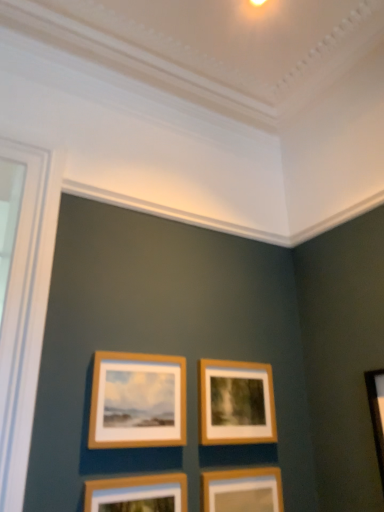
Where is `wooden frame at center, which is the third picture frame from bottom to top`? wooden frame at center, which is the third picture frame from bottom to top is located at coordinates (236, 403).

Find the location of a particular element. wooden picture frame at lower center, which ranks as the 2th picture frame in bottom-to-top order is located at coordinates 138,494.

Where is `wooden frame at center, which is the third picture frame from bottom to top`? This screenshot has width=384, height=512. wooden frame at center, which is the third picture frame from bottom to top is located at coordinates click(x=236, y=403).

Who is taller, wooden picture frame at lower center, which ranks as the 2th picture frame in bottom-to-top order, or wooden picture frame at lower center, which is the 4th picture frame from top to bottom?

wooden picture frame at lower center, which ranks as the 2th picture frame in bottom-to-top order.

Can you confirm if wooden picture frame at lower center, which ranks as the 2th picture frame in bottom-to-top order, is smaller than wooden picture frame at lower center, which is counted as the 1th picture frame, starting from the bottom?

Incorrect, wooden picture frame at lower center, which ranks as the 2th picture frame in bottom-to-top order, is not smaller in size than wooden picture frame at lower center, which is counted as the 1th picture frame, starting from the bottom.

Between wooden picture frame at lower center, which is counted as the 1th picture frame, starting from the bottom, and wooden picture frame at lower center, the third picture frame when ordered from top to bottom, which one appears on the right side from the viewer's perspective?

wooden picture frame at lower center, which is counted as the 1th picture frame, starting from the bottom.

Is wooden picture frame at lower center, which is counted as the 1th picture frame, starting from the bottom, spatially inside wooden picture frame at lower center, the third picture frame when ordered from top to bottom, or outside of it?

wooden picture frame at lower center, which is counted as the 1th picture frame, starting from the bottom, is outside wooden picture frame at lower center, the third picture frame when ordered from top to bottom.

Which of these two, wooden picture frame at lower center, which is counted as the 1th picture frame, starting from the bottom, or wooden picture frame at lower center, the third picture frame when ordered from top to bottom, stands shorter?

wooden picture frame at lower center, which is counted as the 1th picture frame, starting from the bottom, is shorter.

Is point (266, 472) closer to viewer compared to point (91, 508)?

No, (266, 472) is further to viewer.

Is wooden frame at center, the second picture frame from the top, behind wooden frame at center, placed as the fourth picture frame when sorted from bottom to top?

Yes, it is behind wooden frame at center, placed as the fourth picture frame when sorted from bottom to top.

From the image's perspective, is wooden frame at center, which is the third picture frame from bottom to top, above or below wooden frame at center, which ranks as the first picture frame in top-to-bottom order?

Clearly, from the image's perspective, wooden frame at center, which is the third picture frame from bottom to top, is below wooden frame at center, which ranks as the first picture frame in top-to-bottom order.

Is wooden frame at center, the second picture frame from the top, looking in the opposite direction of wooden frame at center, which ranks as the first picture frame in top-to-bottom order?

No, wooden frame at center, the second picture frame from the top,'s orientation is not away from wooden frame at center, which ranks as the first picture frame in top-to-bottom order.

Between wooden frame at center, which is the third picture frame from bottom to top, and wooden frame at center, which ranks as the first picture frame in top-to-bottom order, which one has smaller size?

wooden frame at center, which is the third picture frame from bottom to top.

From a real-world perspective, which is physically above, wooden frame at center, which is the third picture frame from bottom to top, or wooden picture frame at lower center, which is the 4th picture frame from top to bottom?

In real-world perspective, wooden frame at center, which is the third picture frame from bottom to top, is above.

Is wooden frame at center, the second picture frame from the top, not close to wooden picture frame at lower center, which is counted as the 1th picture frame, starting from the bottom?

No, wooden frame at center, the second picture frame from the top, is not far from wooden picture frame at lower center, which is counted as the 1th picture frame, starting from the bottom.

Is wooden picture frame at lower center, which is counted as the 1th picture frame, starting from the bottom, inside wooden frame at center, the second picture frame from the top?

No, wooden frame at center, the second picture frame from the top, does not contain wooden picture frame at lower center, which is counted as the 1th picture frame, starting from the bottom.

Considering the relative positions of wooden frame at center, placed as the fourth picture frame when sorted from bottom to top, and wooden picture frame at lower center, which is the 4th picture frame from top to bottom, in the image provided, is wooden frame at center, placed as the fourth picture frame when sorted from bottom to top, to the left of wooden picture frame at lower center, which is the 4th picture frame from top to bottom, from the viewer's perspective?

Correct, you'll find wooden frame at center, placed as the fourth picture frame when sorted from bottom to top, to the left of wooden picture frame at lower center, which is the 4th picture frame from top to bottom.

In the image, is wooden frame at center, placed as the fourth picture frame when sorted from bottom to top, positioned in front of or behind wooden picture frame at lower center, which is counted as the 1th picture frame, starting from the bottom?

wooden frame at center, placed as the fourth picture frame when sorted from bottom to top, is in front of wooden picture frame at lower center, which is counted as the 1th picture frame, starting from the bottom.

From the image's perspective, starting from the wooden frame at center, which ranks as the first picture frame in top-to-bottom order, which picture frame is the 3rd one below? Please provide its 2D coordinates.

[(242, 490)]

From the image's perspective, is wooden frame at center, placed as the fourth picture frame when sorted from bottom to top, located above or below wooden frame at center, which is the third picture frame from bottom to top?

Based on their image positions, wooden frame at center, placed as the fourth picture frame when sorted from bottom to top, is located above wooden frame at center, which is the third picture frame from bottom to top.

Which of these two, wooden frame at center, which ranks as the first picture frame in top-to-bottom order, or wooden frame at center, the second picture frame from the top, stands taller?

wooden frame at center, which ranks as the first picture frame in top-to-bottom order.

Is point (169, 443) positioned before point (231, 390)?

Yes.

Is wooden frame at center, the second picture frame from the top, completely or partially inside wooden frame at center, placed as the fourth picture frame when sorted from bottom to top?

No.

From the image's perspective, is wooden picture frame at lower center, which ranks as the 2th picture frame in bottom-to-top order, above or below wooden frame at center, placed as the fourth picture frame when sorted from bottom to top?

wooden picture frame at lower center, which ranks as the 2th picture frame in bottom-to-top order, is situated lower than wooden frame at center, placed as the fourth picture frame when sorted from bottom to top, in the image.

Can you confirm if wooden picture frame at lower center, which ranks as the 2th picture frame in bottom-to-top order, is positioned to the left of wooden frame at center, which ranks as the first picture frame in top-to-bottom order?

Incorrect, wooden picture frame at lower center, which ranks as the 2th picture frame in bottom-to-top order, is not on the left side of wooden frame at center, which ranks as the first picture frame in top-to-bottom order.

Which is behind, wooden picture frame at lower center, the third picture frame when ordered from top to bottom, or wooden frame at center, which ranks as the first picture frame in top-to-bottom order?

wooden frame at center, which ranks as the first picture frame in top-to-bottom order, is further from the camera.

From the wooden picture frame at lower center, which ranks as the 2th picture frame in bottom-to-top order, count 2nd picture frames backward and point to it. Please provide its 2D coordinates.

[(242, 490)]

From a real-world perspective, which picture frame is the 1st one above the wooden picture frame at lower center, which is counted as the 1th picture frame, starting from the bottom? Please provide its 2D coordinates.

[(138, 494)]

Estimate the real-world distances between objects in this image. Which object is closer to wooden frame at center, which is the third picture frame from bottom to top, wooden picture frame at lower center, the third picture frame when ordered from top to bottom, or wooden frame at center, placed as the fourth picture frame when sorted from bottom to top?

Based on the image, wooden frame at center, placed as the fourth picture frame when sorted from bottom to top, appears to be nearer to wooden frame at center, which is the third picture frame from bottom to top.

Considering their positions, is wooden frame at center, which is the third picture frame from bottom to top, positioned closer to wooden picture frame at lower center, which is counted as the 1th picture frame, starting from the bottom, than wooden frame at center, which ranks as the first picture frame in top-to-bottom order?

wooden frame at center, which is the third picture frame from bottom to top, lies closer to wooden picture frame at lower center, which is counted as the 1th picture frame, starting from the bottom, than the other object.

Estimate the real-world distances between objects in this image. Which object is further from wooden picture frame at lower center, which is counted as the 1th picture frame, starting from the bottom, wooden frame at center, placed as the fourth picture frame when sorted from bottom to top, or wooden picture frame at lower center, the third picture frame when ordered from top to bottom?

wooden frame at center, placed as the fourth picture frame when sorted from bottom to top, is positioned further to the anchor wooden picture frame at lower center, which is counted as the 1th picture frame, starting from the bottom.

Which object lies further to the anchor point wooden frame at center, which is the third picture frame from bottom to top, wooden picture frame at lower center, which is the 4th picture frame from top to bottom, or wooden picture frame at lower center, which ranks as the 2th picture frame in bottom-to-top order?

The object further to wooden frame at center, which is the third picture frame from bottom to top, is wooden picture frame at lower center, which ranks as the 2th picture frame in bottom-to-top order.

Based on their spatial positions, is wooden frame at center, the second picture frame from the top, or wooden picture frame at lower center, which is counted as the 1th picture frame, starting from the bottom, closer to wooden picture frame at lower center, which ranks as the 2th picture frame in bottom-to-top order?

wooden picture frame at lower center, which is counted as the 1th picture frame, starting from the bottom, is closer to wooden picture frame at lower center, which ranks as the 2th picture frame in bottom-to-top order.

Based on their spatial positions, is wooden frame at center, placed as the fourth picture frame when sorted from bottom to top, or wooden picture frame at lower center, which is the 4th picture frame from top to bottom, further from wooden frame at center, the second picture frame from the top?

wooden frame at center, placed as the fourth picture frame when sorted from bottom to top, is positioned further to the anchor wooden frame at center, the second picture frame from the top.

Estimate the real-world distances between objects in this image. Which object is further from wooden picture frame at lower center, which is the 4th picture frame from top to bottom, wooden frame at center, which is the third picture frame from bottom to top, or wooden picture frame at lower center, the third picture frame when ordered from top to bottom?

wooden picture frame at lower center, the third picture frame when ordered from top to bottom, is further to wooden picture frame at lower center, which is the 4th picture frame from top to bottom.

Estimate the real-world distances between objects in this image. Which object is further from wooden picture frame at lower center, which is counted as the 1th picture frame, starting from the bottom, wooden picture frame at lower center, which ranks as the 2th picture frame in bottom-to-top order, or wooden frame at center, which is the third picture frame from bottom to top?

Among the two, wooden picture frame at lower center, which ranks as the 2th picture frame in bottom-to-top order, is located further to wooden picture frame at lower center, which is counted as the 1th picture frame, starting from the bottom.

The image size is (384, 512). In order to click on picture frame between wooden frame at center, placed as the fourth picture frame when sorted from bottom to top, and wooden frame at center, the second picture frame from the top, from left to right in this screenshot , I will do `click(138, 494)`.

I want to click on picture frame between wooden picture frame at lower center, the third picture frame when ordered from top to bottom, and wooden picture frame at lower center, which is counted as the 1th picture frame, starting from the bottom, in the horizontal direction, so click(x=236, y=403).